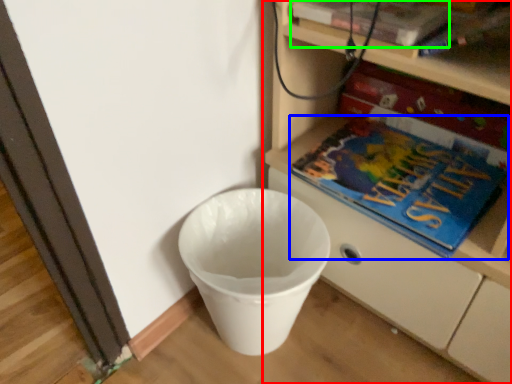
Question: Which object is the closest to the shelf (highlighted by a red box)? Choose among these: book (highlighted by a blue box) or paperback book (highlighted by a green box).

Choices:
 (A) book
 (B) paperback book

Answer: (A)